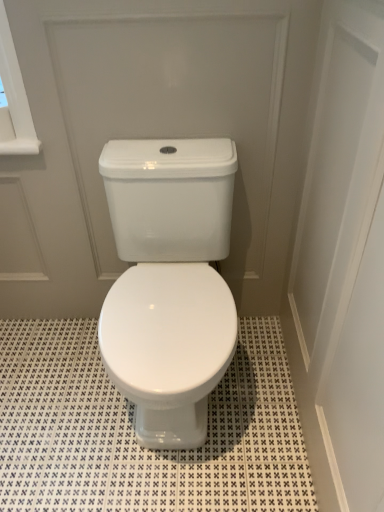
Question: Considering the relative sizes of white glossy door at upper center, the 2th screen door positioned from the left, and white glossy tile at center in the image provided, is white glossy door at upper center, the 2th screen door positioned from the left, taller than white glossy tile at center?

Choices:
 (A) yes
 (B) no

Answer: (A)

Question: Is white glossy door at upper center, placed as the 1th screen door when sorted from right to left, looking in the opposite direction of white glossy tile at center?

Choices:
 (A) yes
 (B) no

Answer: (B)

Question: Could you tell me if white glossy door at upper center, the 2th screen door positioned from the left, is turned towards white glossy tile at center?

Choices:
 (A) no
 (B) yes

Answer: (B)

Question: Does white glossy door at upper center, the 2th screen door positioned from the left, have a larger size compared to white glossy tile at center?

Choices:
 (A) no
 (B) yes

Answer: (B)

Question: Is white glossy door at upper center, placed as the 1th screen door when sorted from right to left, at the left side of white glossy tile at center?

Choices:
 (A) yes
 (B) no

Answer: (B)

Question: Is white glossy door at upper center, placed as the 1th screen door when sorted from right to left, behind white glossy toilet at center, the 2th screen door when ordered from right to left?

Choices:
 (A) yes
 (B) no

Answer: (B)

Question: From the image's perspective, would you say white glossy door at upper center, placed as the 1th screen door when sorted from right to left, is shown under white glossy toilet at center, acting as the 1th screen door starting from the left?

Choices:
 (A) yes
 (B) no

Answer: (A)

Question: Is white glossy toilet at center, acting as the 1th screen door starting from the left, inside white glossy door at upper center, the 2th screen door positioned from the left?

Choices:
 (A) no
 (B) yes

Answer: (A)

Question: Is white glossy door at upper center, placed as the 1th screen door when sorted from right to left, outside of white glossy toilet at center, the 2th screen door when ordered from right to left?

Choices:
 (A) no
 (B) yes

Answer: (B)

Question: Is white glossy door at upper center, placed as the 1th screen door when sorted from right to left, wider than white glossy toilet at center, acting as the 1th screen door starting from the left?

Choices:
 (A) no
 (B) yes

Answer: (B)

Question: Is white glossy door at upper center, the 2th screen door positioned from the left, aimed at white glossy toilet at center, acting as the 1th screen door starting from the left?

Choices:
 (A) yes
 (B) no

Answer: (A)

Question: From a real-world perspective, is white glossy tile at center positioned under white glossy toilet at center, acting as the 1th screen door starting from the left, based on gravity?

Choices:
 (A) yes
 (B) no

Answer: (A)